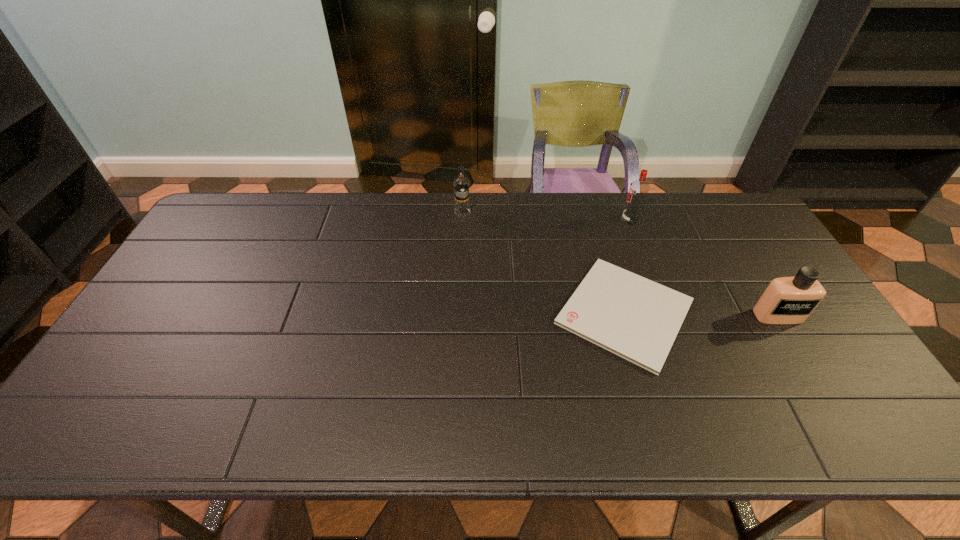
Identify the location of object that is at the right edge. This screenshot has height=540, width=960. (787, 300).

Locate an element on the screen. Image resolution: width=960 pixels, height=540 pixels. blank area at the far edge is located at coordinates (534, 212).

The height and width of the screenshot is (540, 960). In the image, there is a desktop. In order to click on vacant space at the near edge in this screenshot , I will do `click(750, 425)`.

Identify the location of free space at the left edge. (166, 306).

The image size is (960, 540). In order to click on free space at the right edge of the desktop in this screenshot , I will do `click(751, 261)`.

This screenshot has height=540, width=960. I want to click on free spot at the far right corner of the desktop, so click(x=722, y=226).

Identify the location of free area in between the left vodka and the perfume. This screenshot has height=540, width=960. (620, 264).

This screenshot has height=540, width=960. Find the location of `free space between the perfume and the left vodka`. free space between the perfume and the left vodka is located at coordinates (620, 264).

The height and width of the screenshot is (540, 960). I want to click on vacant space in between the clipboard and the rightmost object, so click(x=701, y=314).

Find the location of `free space that is in between the left vodka and the right vodka`. free space that is in between the left vodka and the right vodka is located at coordinates (546, 217).